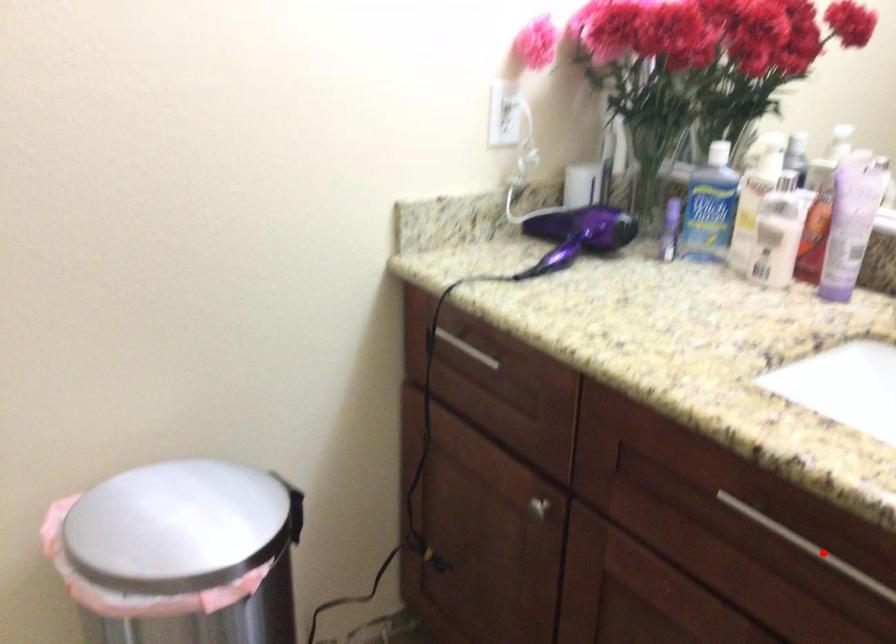
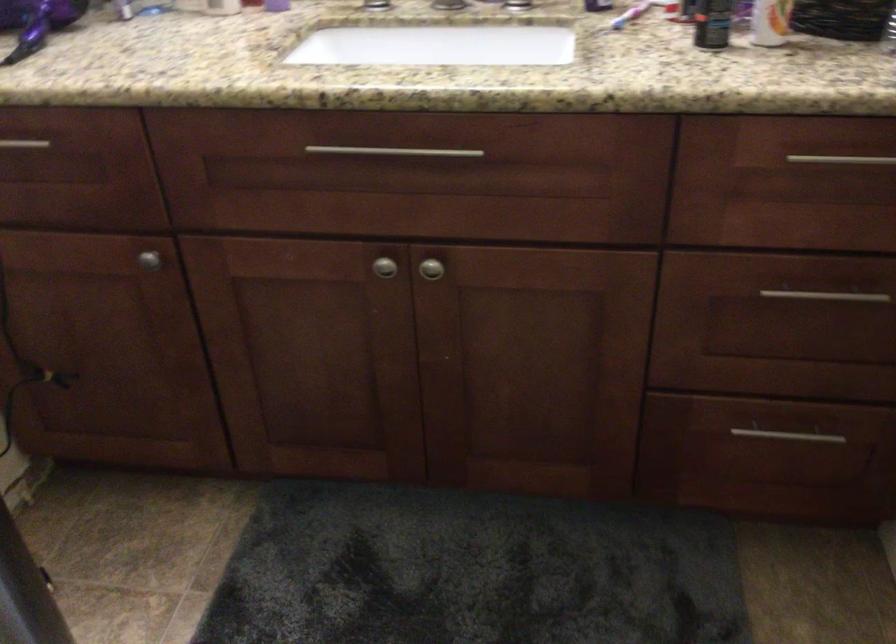
Where in the second image is the point corresponding to the highlighted location from the first image?

(394, 152)